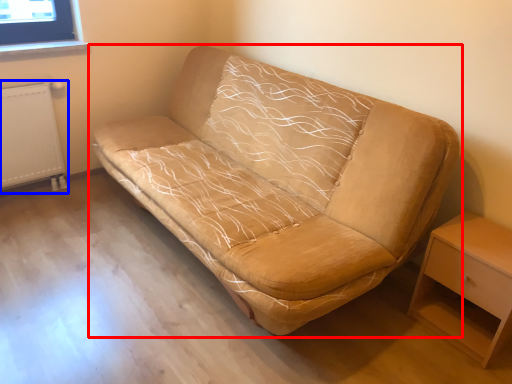
Question: Which object appears closest to the camera in this image, studio couch (highlighted by a red box) or radiator (highlighted by a blue box)?

Choices:
 (A) studio couch
 (B) radiator

Answer: (A)